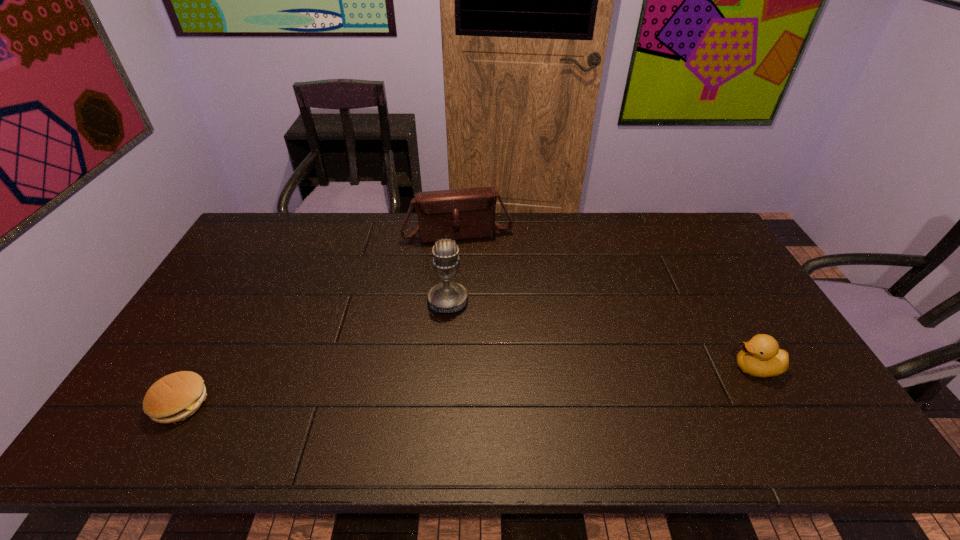
This screenshot has height=540, width=960. Identify the location of the closest object relative to the third tallest object. (448, 297).

Point out which object is positioned as the third nearest to the second tallest object. Please provide its 2D coordinates. Your answer should be formatted as a tuple, i.e. [(x, y)], where the tuple contains the x and y coordinates of a point satisfying the conditions above.

[(760, 357)]

At what (x,y) coordinates should I click in order to perform the action: click on free space that satisfies the following two spatial constraints: 1. on the back side of the third shortest object; 2. on the right side of the patty. Please return your answer as a coordinate pair (x, y). This screenshot has height=540, width=960. Looking at the image, I should click on (277, 233).

The height and width of the screenshot is (540, 960). In order to click on free spot that satisfies the following two spatial constraints: 1. on the front side of the rightmost object; 2. on the face of the shoulder bag in this screenshot , I will do `click(449, 368)`.